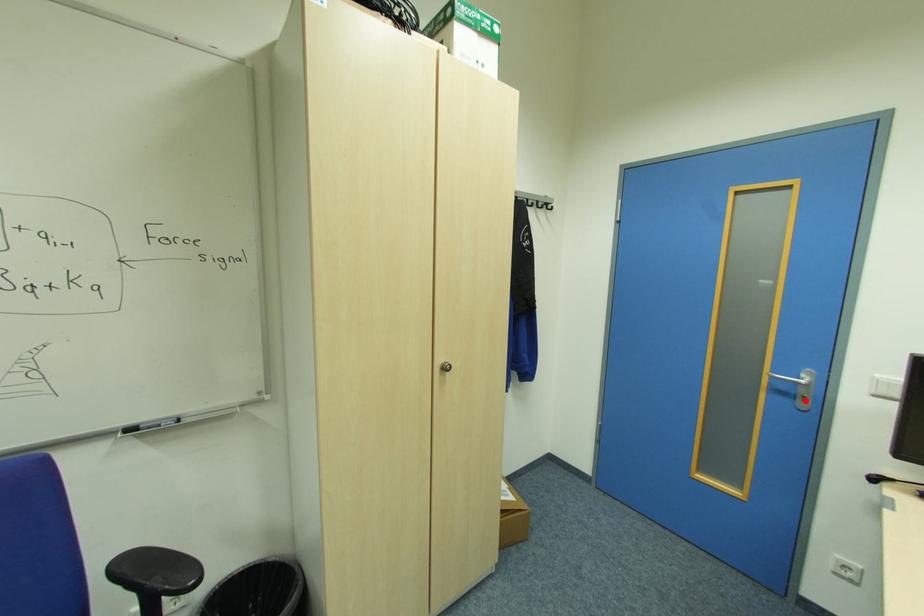
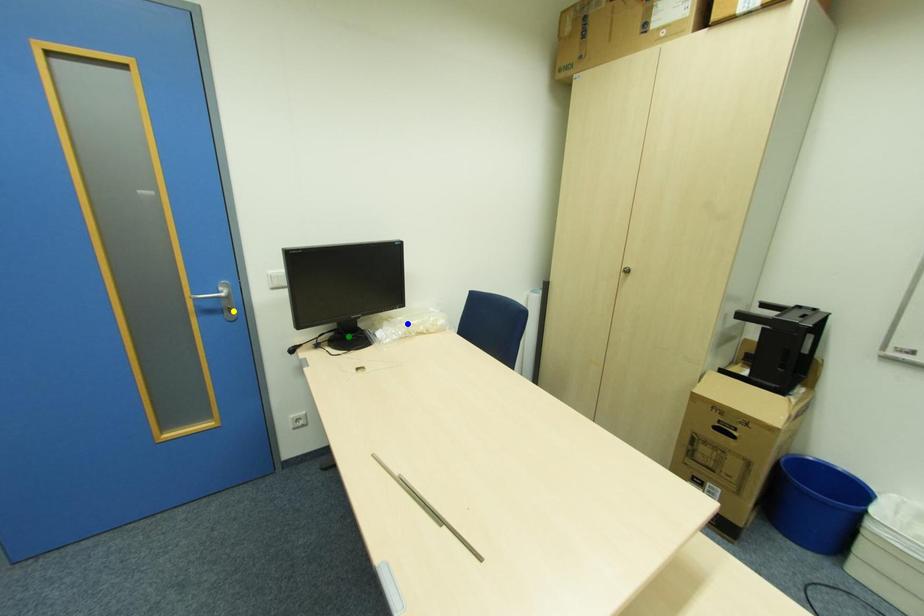
Question: I am providing you with two images of the same scene from different viewpoints. A red point is marked on the first image. You are given multiple points on the second image. Which point in image 2 represents the same 3d spot as the red point in image 1?

Choices:
 (A) blue point
 (B) green point
 (C) yellow point

Answer: (C)